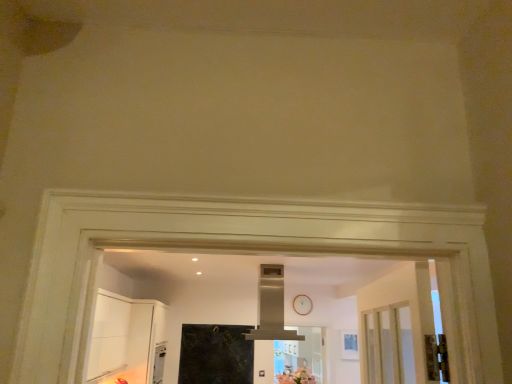
Question: Would you say satin silver exhaust hood at center is a long distance from pink matte flower at center?

Choices:
 (A) yes
 (B) no

Answer: (B)

Question: Does satin silver exhaust hood at center have a smaller size compared to pink matte flower at center?

Choices:
 (A) no
 (B) yes

Answer: (A)

Question: From a real-world perspective, is satin silver exhaust hood at center positioned under pink matte flower at center based on gravity?

Choices:
 (A) yes
 (B) no

Answer: (B)

Question: Is satin silver exhaust hood at center oriented away from pink matte flower at center?

Choices:
 (A) no
 (B) yes

Answer: (A)

Question: Is satin silver exhaust hood at center placed right next to pink matte flower at center?

Choices:
 (A) no
 (B) yes

Answer: (A)

Question: Could you tell me if satin silver exhaust hood at center is facing pink matte flower at center?

Choices:
 (A) yes
 (B) no

Answer: (B)

Question: Considering the relative positions of pink matte flower at center and satin silver exhaust hood at center in the image provided, is pink matte flower at center to the left of satin silver exhaust hood at center from the viewer's perspective?

Choices:
 (A) yes
 (B) no

Answer: (B)

Question: Can you confirm if pink matte flower at center is smaller than satin silver exhaust hood at center?

Choices:
 (A) no
 (B) yes

Answer: (B)

Question: From a real-world perspective, is pink matte flower at center positioned over satin silver exhaust hood at center based on gravity?

Choices:
 (A) no
 (B) yes

Answer: (A)

Question: From a real-world perspective, is pink matte flower at center positioned under satin silver exhaust hood at center based on gravity?

Choices:
 (A) yes
 (B) no

Answer: (A)

Question: Is pink matte flower at center wider than satin silver exhaust hood at center?

Choices:
 (A) no
 (B) yes

Answer: (A)

Question: Considering the relative sizes of pink matte flower at center and satin silver exhaust hood at center in the image provided, is pink matte flower at center bigger than satin silver exhaust hood at center?

Choices:
 (A) no
 (B) yes

Answer: (A)

Question: In terms of width, does pink matte flower at center look wider or thinner when compared to satin silver exhaust hood at center?

Choices:
 (A) wide
 (B) thin

Answer: (B)